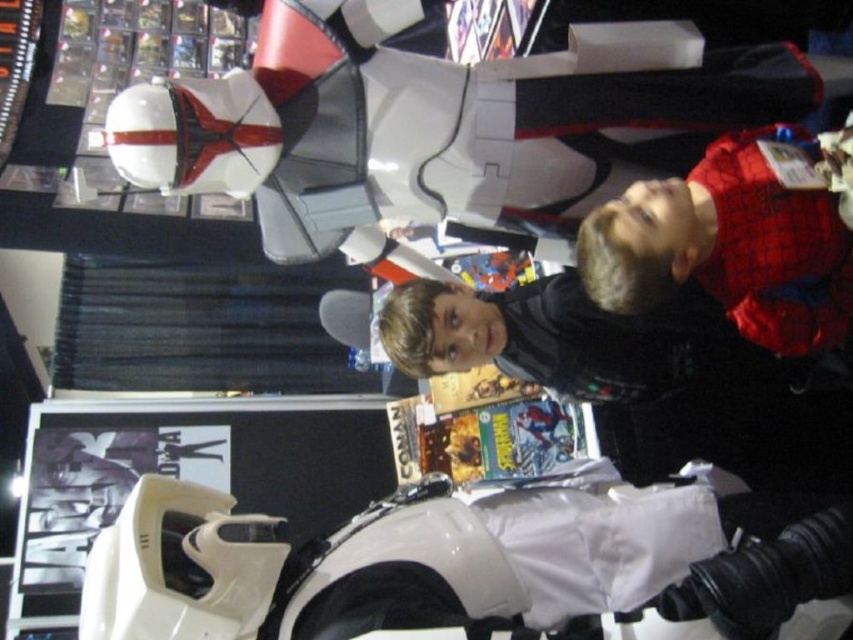
Is white glossy helmet at lower left to the right of matte white astronaut at upper right from the viewer's perspective?

Result: Incorrect, white glossy helmet at lower left is not on the right side of matte white astronaut at upper right.

Who is lower down, white glossy helmet at lower left or matte white astronaut at upper right?

Positioned lower is white glossy helmet at lower left.

Which is in front, point (202, 588) or point (788, 264)?

Point (202, 588) is more forward.

Where is `white glossy helmet at lower left`? white glossy helmet at lower left is located at coordinates (474, 566).

Which is behind, point (547, 212) or point (790, 276)?

The point (547, 212) is behind.

Which is more to the left, white glossy helmet at upper left or matte white astronaut at upper right?

From the viewer's perspective, white glossy helmet at upper left appears more on the left side.

The height and width of the screenshot is (640, 853). What are the coordinates of `white glossy helmet at upper left` in the screenshot? It's located at (440, 124).

Is white glossy helmet at upper left in front of white glossy helmet at lower left?

No, white glossy helmet at upper left is further to the viewer.

Is white glossy helmet at upper left behind white glossy helmet at lower left?

That is True.

At what (x,y) coordinates should I click in order to perform the action: click on white glossy helmet at upper left. Please return your answer as a coordinate pair (x, y). The width and height of the screenshot is (853, 640). Looking at the image, I should click on (440, 124).